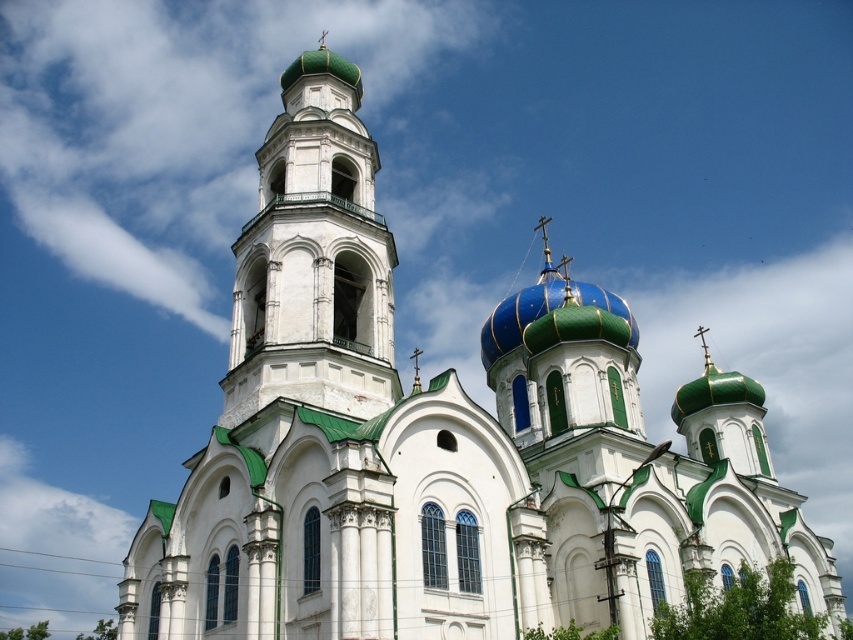
Question: Is the position of white stone bell tower at center more distant than that of blue metallic dome at center?

Choices:
 (A) no
 (B) yes

Answer: (A)

Question: Which point is farther to the camera?

Choices:
 (A) (527, 296)
 (B) (358, 227)

Answer: (A)

Question: Can you confirm if white stone bell tower at center is wider than blue metallic dome at center?

Choices:
 (A) yes
 (B) no

Answer: (B)

Question: Which point appears closest to the camera in this image?

Choices:
 (A) (351, 116)
 (B) (585, 300)

Answer: (A)

Question: Is white stone bell tower at center to the right of blue metallic dome at center from the viewer's perspective?

Choices:
 (A) yes
 (B) no

Answer: (B)